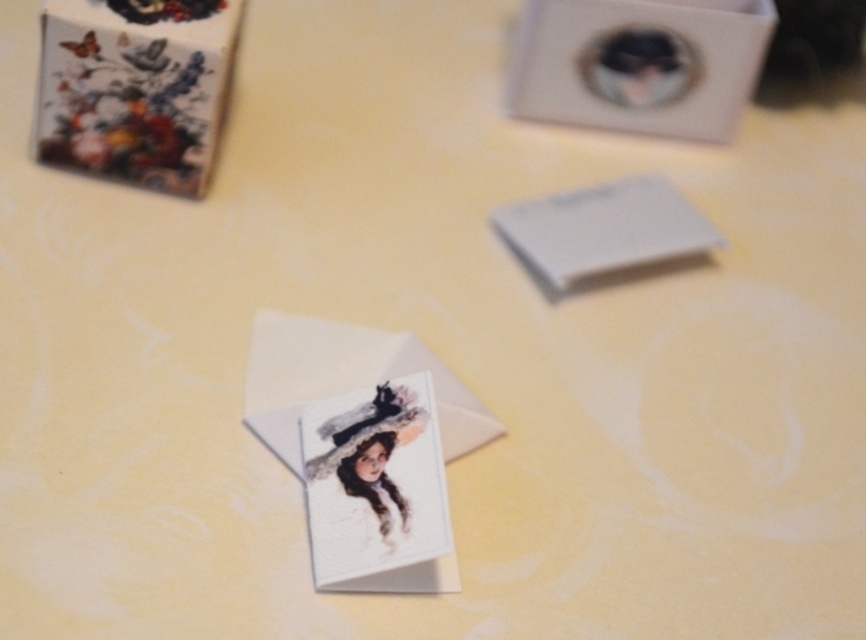
Question: Among these objects, which one is nearest to the camera?

Choices:
 (A) watercolor paper card at center
 (B) white cardboard box at upper center

Answer: (A)

Question: Is matte floral box at upper left thinner than watercolor paper card at center?

Choices:
 (A) yes
 (B) no

Answer: (B)

Question: Considering the real-world distances, which object is closest to the white cardboard box at upper center?

Choices:
 (A) white paper envelope at center
 (B) watercolor paper card at center

Answer: (A)

Question: Based on their relative distances, which object is nearer to the matte floral box at upper left?

Choices:
 (A) white cardboard box at upper center
 (B) white paper envelope at center
 (C) watercolor paper card at center

Answer: (B)

Question: Does white cardboard box at upper center have a larger size compared to watercolor paper card at center?

Choices:
 (A) yes
 (B) no

Answer: (A)

Question: Can you confirm if matte floral box at upper left is thinner than white paper envelope at center?

Choices:
 (A) no
 (B) yes

Answer: (B)